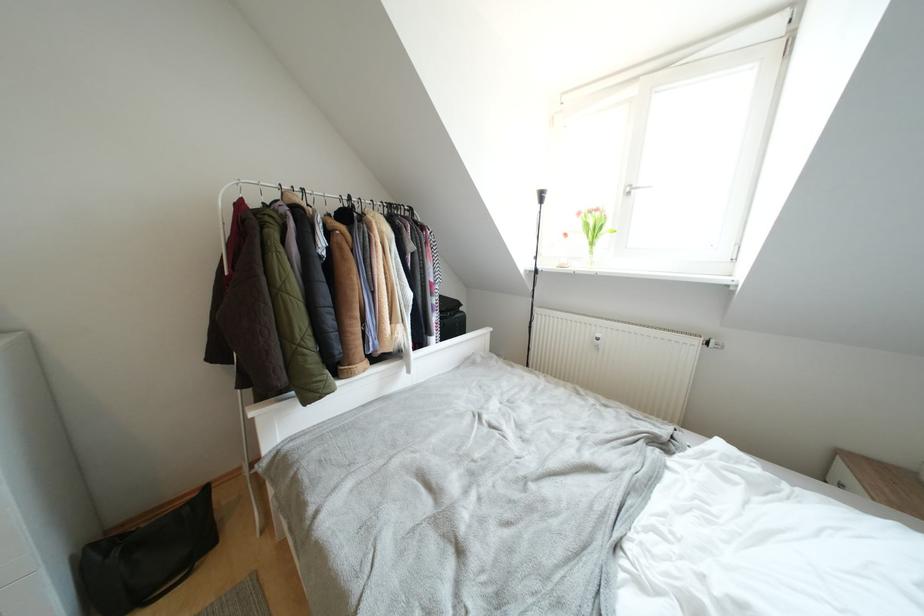
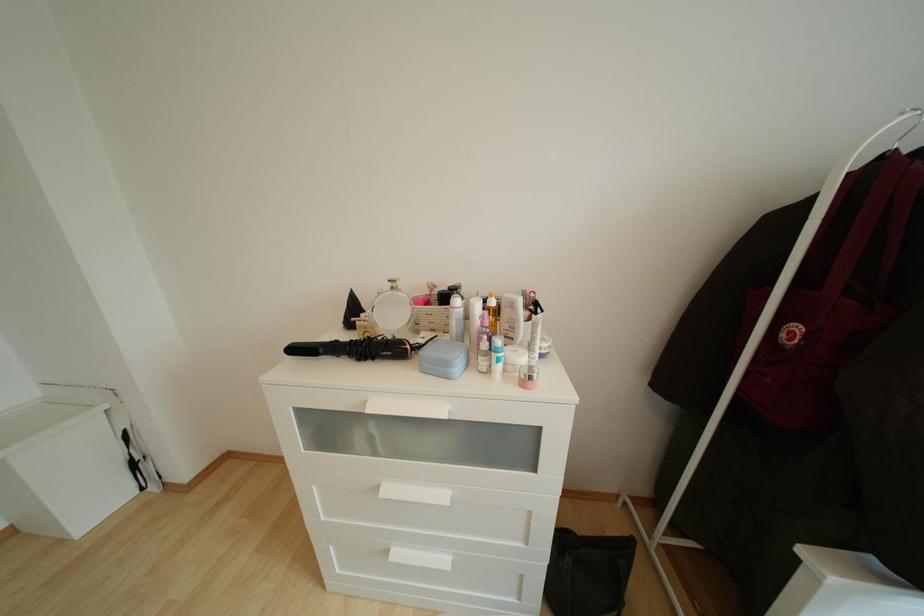
Question: The first image is from the beginning of the video and the second image is from the end. How did the camera likely rotate when shooting the video?

Choices:
 (A) Left
 (B) Right
 (C) Up
 (D) Down

Answer: (A)